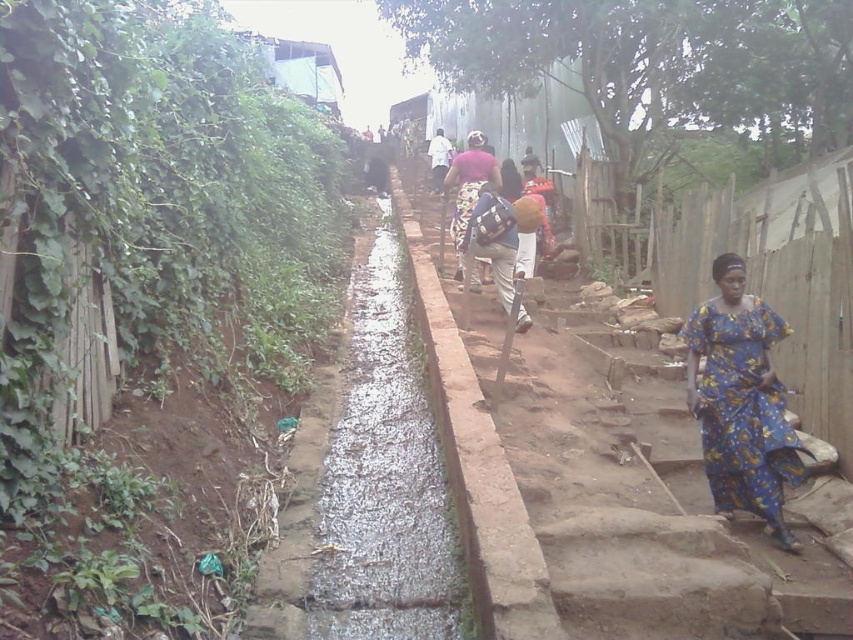
Does concrete steps at center come behind matte pink fabric at center?

No, concrete steps at center is closer to the viewer.

Between point (534, 465) and point (462, 268), which one is positioned behind?

The point (462, 268) is more distant.

Locate an element on the screen. Image resolution: width=853 pixels, height=640 pixels. concrete steps at center is located at coordinates (646, 497).

The image size is (853, 640). In order to click on concrete steps at center in this screenshot , I will do `click(646, 497)`.

Is concrete steps at center taller than blue printed fabric dress at lower right?

Yes, concrete steps at center is taller than blue printed fabric dress at lower right.

Locate an element on the screen. The height and width of the screenshot is (640, 853). concrete steps at center is located at coordinates (646, 497).

The image size is (853, 640). Find the location of `concrete steps at center`. concrete steps at center is located at coordinates (646, 497).

Does wet concrete creek at center have a larger size compared to blue printed fabric dress at lower right?

Yes.

Which is above, wet concrete creek at center or blue printed fabric dress at lower right?

Positioned higher is wet concrete creek at center.

I want to click on wet concrete creek at center, so click(364, 484).

At what (x,y) coordinates should I click in order to perform the action: click on wet concrete creek at center. Please return your answer as a coordinate pair (x, y). This screenshot has height=640, width=853. Looking at the image, I should click on (364, 484).